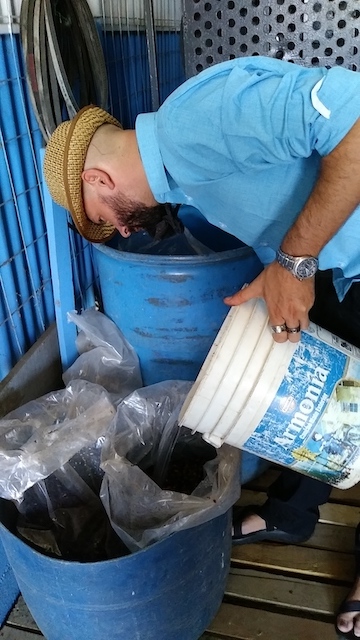
You are a GUI agent. You are given a task and a screenshot of the screen. Output one action in this format:
    pyautogui.click(x=<x>, y=<y>)
    Task: Click on the large blue bucket
    Image resolution: width=360 pixels, height=640 pixels.
    Given the screenshot: What is the action you would take?
    pyautogui.click(x=165, y=331)